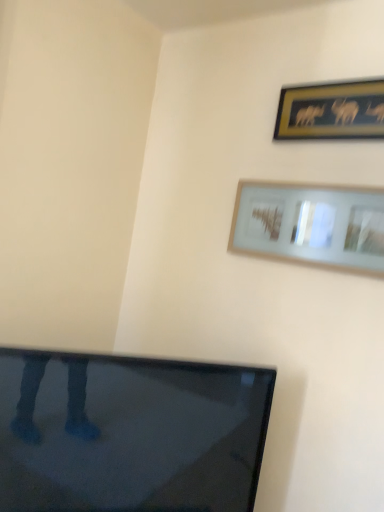
Question: Should I look upward or downward to see matte glass picture frame at upper right, which appears as the 1th picture frame when ordered from the bottom?

Choices:
 (A) down
 (B) up

Answer: (B)

Question: Is gold-framed picture at upper right, marked as the second picture frame in a bottom-to-top arrangement, at the left side of matte glass picture frame at upper right, which appears as the 1th picture frame when ordered from the bottom?

Choices:
 (A) yes
 (B) no

Answer: (B)

Question: Does gold-framed picture at upper right, marked as the second picture frame in a bottom-to-top arrangement, have a greater height compared to matte glass picture frame at upper right, which appears as the 1th picture frame when ordered from the bottom?

Choices:
 (A) yes
 (B) no

Answer: (B)

Question: Are gold-framed picture at upper right, which appears as the first picture frame when viewed from the top, and matte glass picture frame at upper right, which is the second picture frame in top-to-bottom order, located far from each other?

Choices:
 (A) no
 (B) yes

Answer: (A)

Question: Is gold-framed picture at upper right, marked as the second picture frame in a bottom-to-top arrangement, beside matte glass picture frame at upper right, which is the second picture frame in top-to-bottom order?

Choices:
 (A) yes
 (B) no

Answer: (B)

Question: Considering the relative positions of gold-framed picture at upper right, which appears as the first picture frame when viewed from the top, and matte glass picture frame at upper right, which appears as the 1th picture frame when ordered from the bottom, in the image provided, is gold-framed picture at upper right, which appears as the first picture frame when viewed from the top, to the right of matte glass picture frame at upper right, which appears as the 1th picture frame when ordered from the bottom, from the viewer's perspective?

Choices:
 (A) yes
 (B) no

Answer: (A)

Question: Would you say gold-framed picture at upper right, marked as the second picture frame in a bottom-to-top arrangement, contains matte glass picture frame at upper right, which is the second picture frame in top-to-bottom order?

Choices:
 (A) no
 (B) yes

Answer: (A)

Question: Is matte glass picture frame at upper right, which appears as the 1th picture frame when ordered from the bottom, looking in the opposite direction of gold-framed picture at upper right, marked as the second picture frame in a bottom-to-top arrangement?

Choices:
 (A) yes
 (B) no

Answer: (B)

Question: From the image's perspective, is matte glass picture frame at upper right, which appears as the 1th picture frame when ordered from the bottom, located beneath gold-framed picture at upper right, which appears as the first picture frame when viewed from the top?

Choices:
 (A) yes
 (B) no

Answer: (A)

Question: Is matte glass picture frame at upper right, which appears as the 1th picture frame when ordered from the bottom, directly adjacent to gold-framed picture at upper right, which appears as the first picture frame when viewed from the top?

Choices:
 (A) yes
 (B) no

Answer: (B)

Question: Is matte glass picture frame at upper right, which is the second picture frame in top-to-bottom order, oriented towards gold-framed picture at upper right, which appears as the first picture frame when viewed from the top?

Choices:
 (A) no
 (B) yes

Answer: (A)

Question: Is matte glass picture frame at upper right, which appears as the 1th picture frame when ordered from the bottom, taller than gold-framed picture at upper right, marked as the second picture frame in a bottom-to-top arrangement?

Choices:
 (A) no
 (B) yes

Answer: (B)

Question: Is matte glass picture frame at upper right, which appears as the 1th picture frame when ordered from the bottom, to the left of gold-framed picture at upper right, marked as the second picture frame in a bottom-to-top arrangement, from the viewer's perspective?

Choices:
 (A) no
 (B) yes

Answer: (B)

Question: From the image's perspective, is matte glass picture frame at upper right, which appears as the 1th picture frame when ordered from the bottom, positioned above or below gold-framed picture at upper right, which appears as the first picture frame when viewed from the top?

Choices:
 (A) above
 (B) below

Answer: (B)